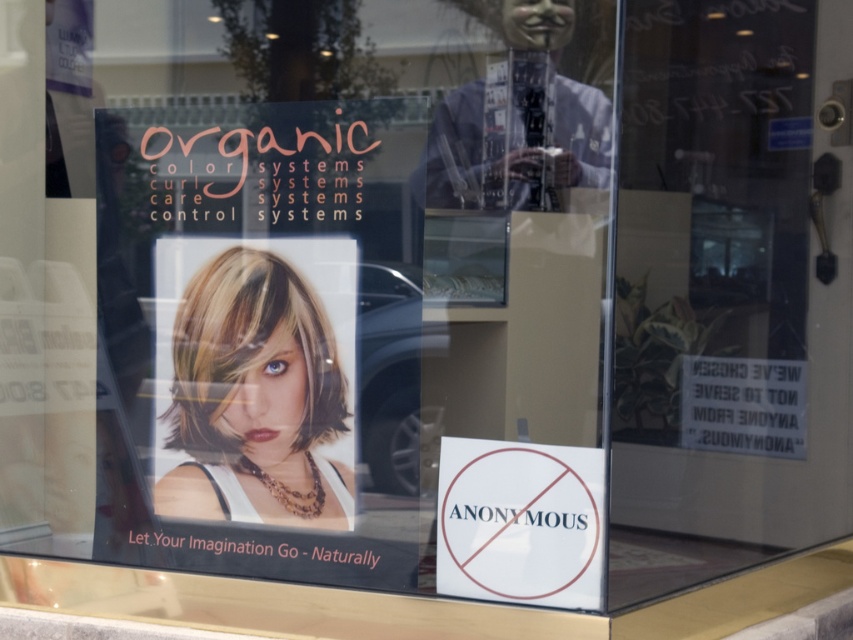
Which is in front, point (196, 276) or point (451, 458)?

Point (451, 458) is in front.

Does blonde hair at center have a greater width compared to white paper sign at lower center?

Yes, blonde hair at center is wider than white paper sign at lower center.

Between point (177, 476) and point (572, 588), which one is positioned behind?

The point (177, 476) is behind.

Where is `blonde hair at center`? This screenshot has height=640, width=853. blonde hair at center is located at coordinates (254, 397).